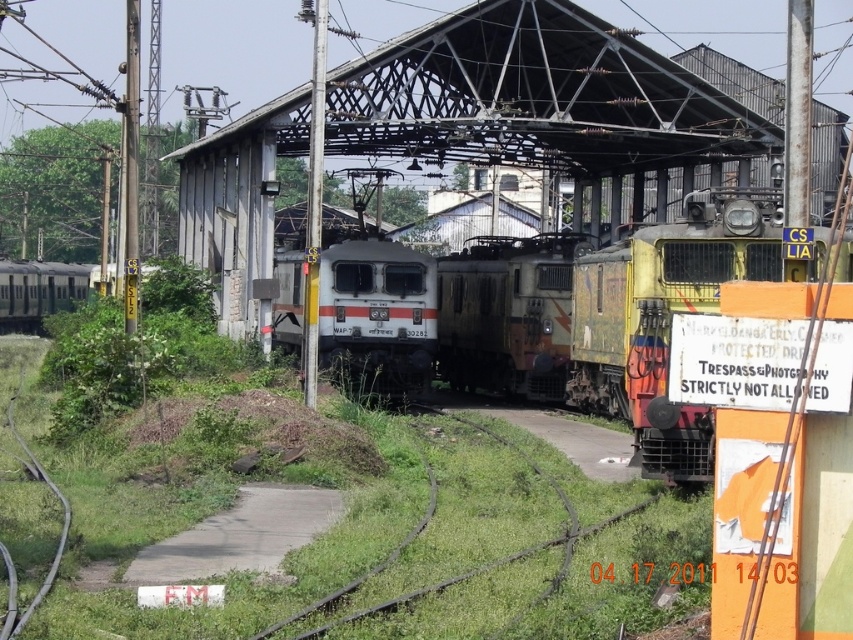
Question: In this image, where is rusty metal train at center located relative to white glossy locomotive at center?

Choices:
 (A) above
 (B) below

Answer: (A)

Question: Among these points, which one is farthest from the camera?

Choices:
 (A) (3, 269)
 (B) (509, 292)
 (C) (570, 528)
 (D) (599, 300)

Answer: (A)

Question: Which of the following is the closest to the observer?

Choices:
 (A) yellow-green painted locomotive at center
 (B) green grass train track at center

Answer: (A)

Question: Is white glossy locomotive at center in front of green grass train track at center?

Choices:
 (A) no
 (B) yes

Answer: (A)

Question: Is yellow-green painted locomotive at center to the left of white glossy locomotive at center from the viewer's perspective?

Choices:
 (A) yes
 (B) no

Answer: (B)

Question: Which of these objects is positioned closest to the white glossy locomotive at center?

Choices:
 (A) silver metallic train at left
 (B) rusty metal train at center
 (C) green grass train track at center
 (D) yellow-green painted locomotive at center

Answer: (B)